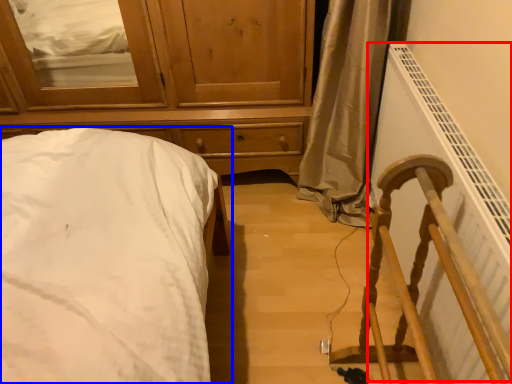
Question: Among these objects, which one is farthest to the camera, radiator (highlighted by a red box) or bed (highlighted by a blue box)?

Choices:
 (A) radiator
 (B) bed

Answer: (B)